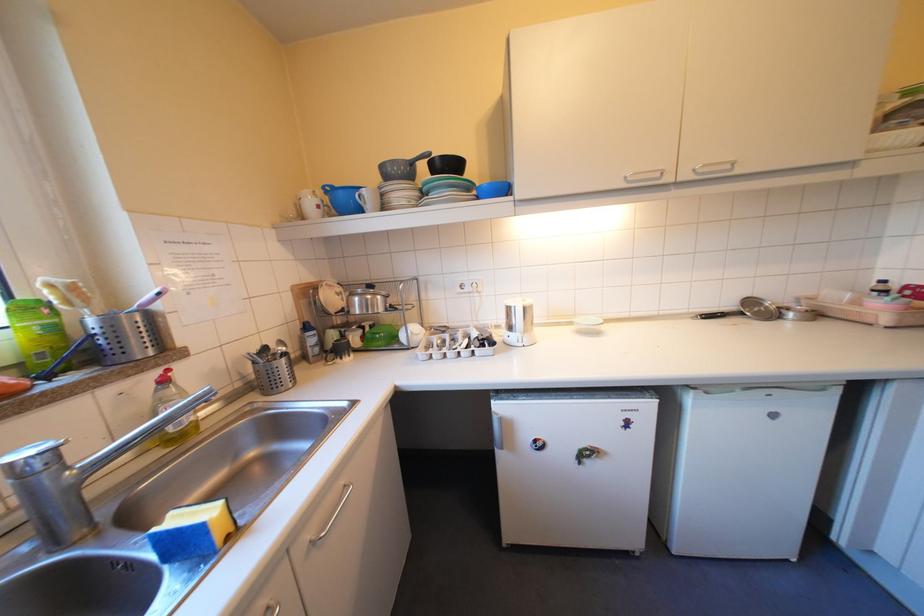
The image size is (924, 616). Describe the element at coordinates (153, 296) in the screenshot. I see `a pink brush handle` at that location.